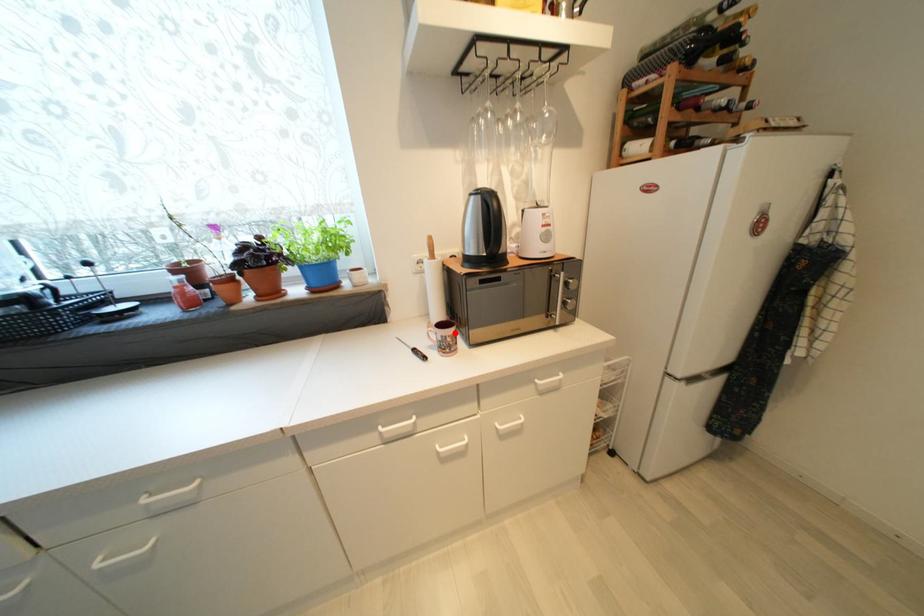
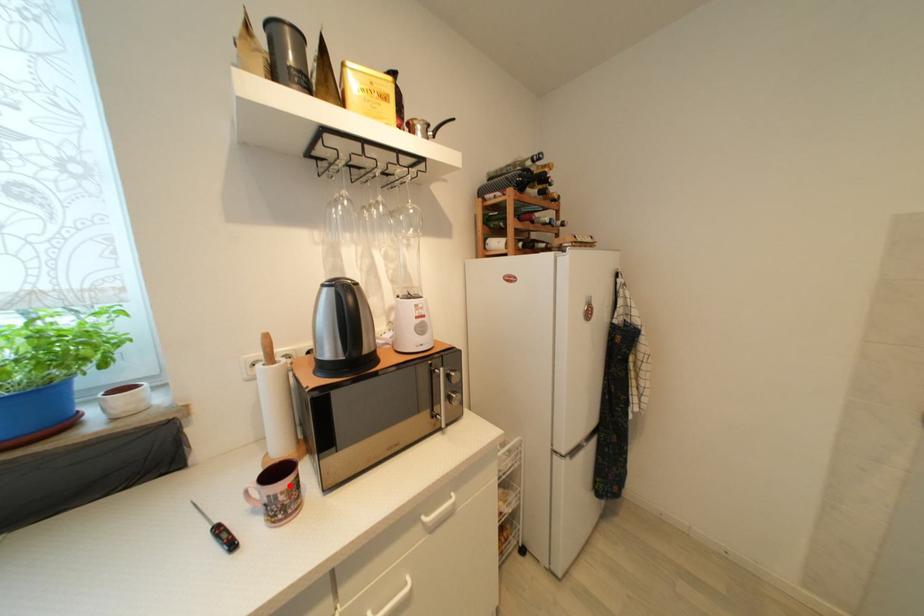
I am providing you with two images of the same scene from different viewpoints. A red point is marked on the first image and another point is marked on the second image. Is the red point in image1 aligned with the point shown in image2?

Yes